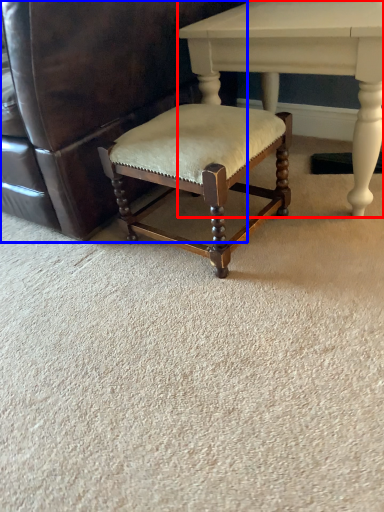
Question: Which of the following is the closest to the observer, table (highlighted by a red box) or chair (highlighted by a blue box)?

Choices:
 (A) table
 (B) chair

Answer: (B)